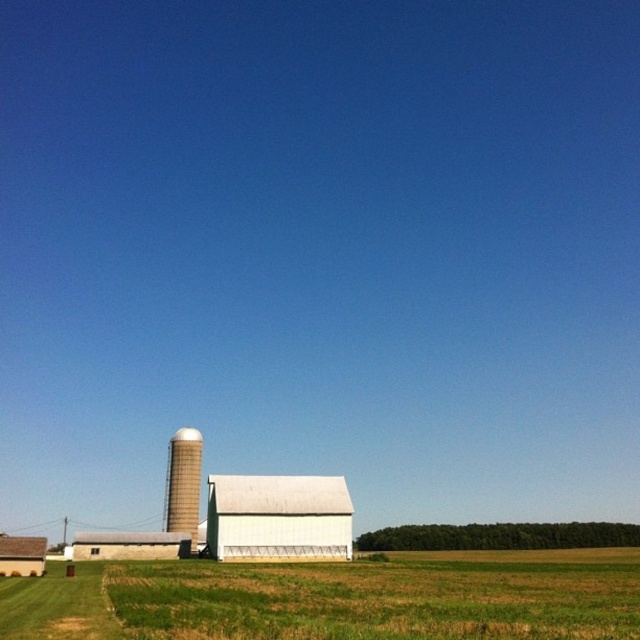
Is green grass at lower center above white matte barn at center?

No, green grass at lower center is not above white matte barn at center.

Which is below, green grass at lower center or white matte barn at center?

green grass at lower center is below.

Looking at this image, measure the distance between point (276, 598) and camera.

The distance of point (276, 598) from camera is 42.91 meters.

The height and width of the screenshot is (640, 640). What are the coordinates of `green grass at lower center` in the screenshot? It's located at (333, 600).

Describe the element at coordinates (131, 545) in the screenshot. I see `white matte barn at lower center` at that location.

Does white matte barn at lower center appear on the left side of white matte barn at lower left?

Indeed, white matte barn at lower center is positioned on the left side of white matte barn at lower left.

Locate an element on the screen. The height and width of the screenshot is (640, 640). white matte barn at lower center is located at coordinates (131, 545).

Can you confirm if white matte silo at center-left is shorter than white matte barn at lower left?

Incorrect, white matte silo at center-left's height does not fall short of white matte barn at lower left's.

Which is in front, point (173, 509) or point (4, 548)?

Point (4, 548) is more forward.

At what (x,y) coordinates should I click in order to perform the action: click on white matte silo at center-left. Please return your answer as a coordinate pair (x, y). Looking at the image, I should click on (182, 483).